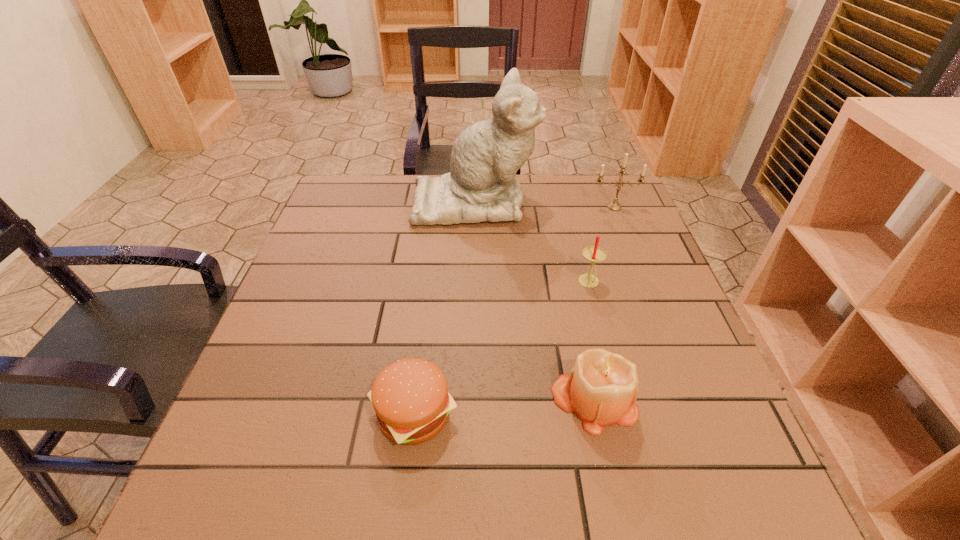
Select which candle is the second closest to the cat. Please provide its 2D coordinates. Your answer should be formatted as a tuple, i.e. [(x, y)], where the tuple contains the x and y coordinates of a point satisfying the conditions above.

[(594, 254)]

Select which candle appears as the closest to the tallest object. Please provide its 2D coordinates. Your answer should be formatted as a tuple, i.e. [(x, y)], where the tuple contains the x and y coordinates of a point satisfying the conditions above.

[(614, 206)]

Locate an element on the screen. vacant space that satisfies the following two spatial constraints: 1. on the back side of the third farthest object; 2. on the front-facing side of the cat is located at coordinates (567, 201).

Find the location of `vacant space that satisfies the following two spatial constraints: 1. on the back side of the hamburger; 2. on the left side of the rightmost candle`. vacant space that satisfies the following two spatial constraints: 1. on the back side of the hamburger; 2. on the left side of the rightmost candle is located at coordinates (439, 207).

What are the coordinates of `blank space that satisfies the following two spatial constraints: 1. on the front-facing side of the tallest object; 2. on the right side of the rightmost candle` in the screenshot? It's located at (474, 207).